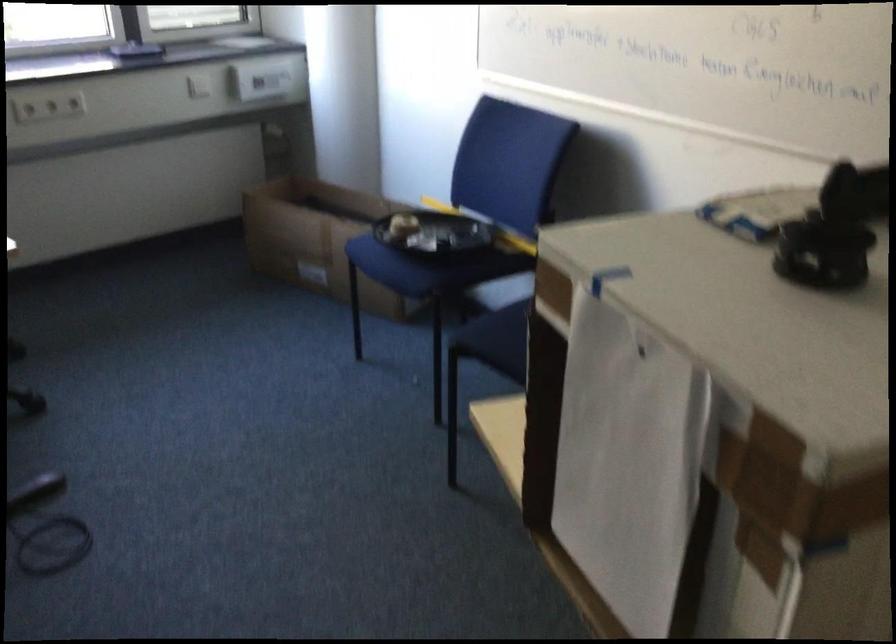
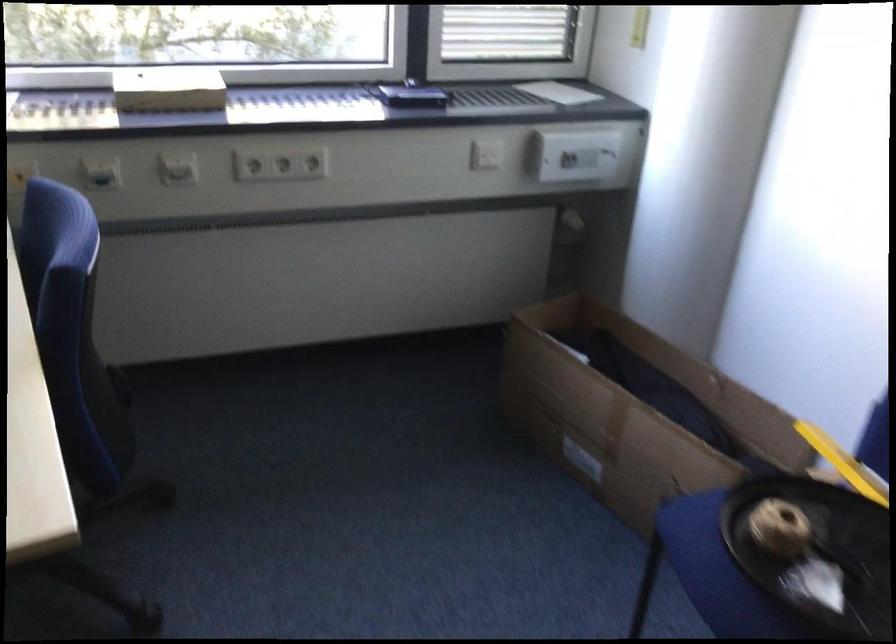
In the second image, find the point that corresponds to point 71,104 in the first image.

(313, 163)